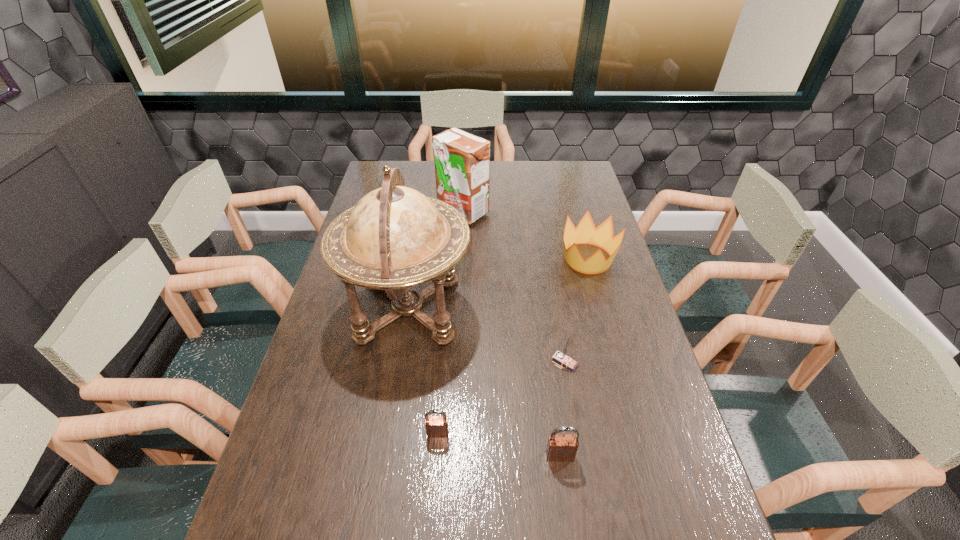
With all padlocks evenly spaced, where should an extra padlock be placed on the right to continue the pattern? Please point out a vacant space. Please provide its 2D coordinates. Your answer should be formatted as a tuple, i.e. [(x, y)], where the tuple contains the x and y coordinates of a point satisfying the conditions above.

[(692, 480)]